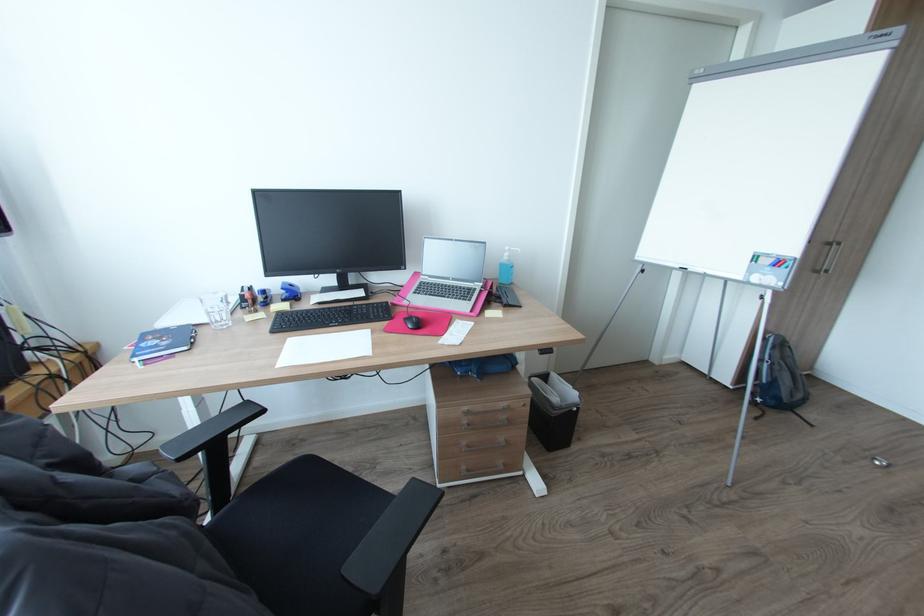
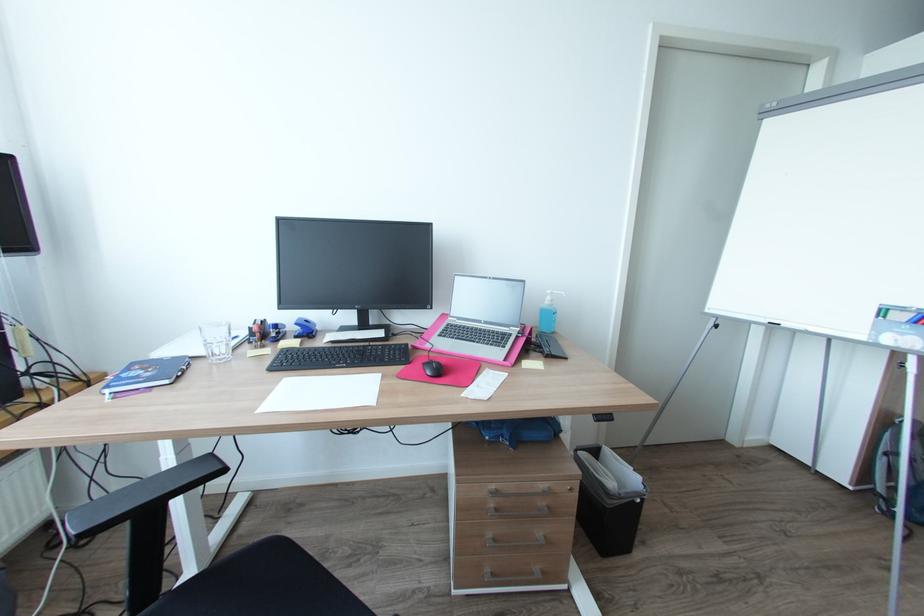
In the second image, find the point that corresponds to (264,408) in the first image.

(223, 468)